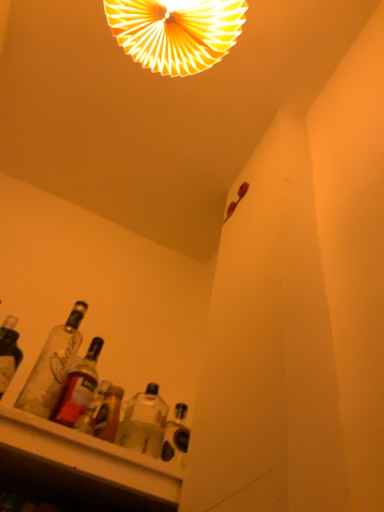
Question: From a real-world perspective, does clear glass bottles at lower left, the 1th bottle positioned from the left, sit lower than translucent glass bottle at lower left, which is counted as the 1th bottle, starting from the right?

Choices:
 (A) no
 (B) yes

Answer: (A)

Question: Does clear glass bottles at lower left, the second bottle when ordered from right to left, have a greater width compared to translucent glass bottle at lower left, which is the second bottle in left-to-right order?

Choices:
 (A) yes
 (B) no

Answer: (A)

Question: From the image's perspective, would you say clear glass bottles at lower left, the second bottle when ordered from right to left, is positioned over translucent glass bottle at lower left, which is the second bottle in left-to-right order?

Choices:
 (A) yes
 (B) no

Answer: (A)

Question: Does clear glass bottles at lower left, the 1th bottle positioned from the left, have a larger size compared to translucent glass bottle at lower left, which is counted as the 1th bottle, starting from the right?

Choices:
 (A) yes
 (B) no

Answer: (A)

Question: Is clear glass bottles at lower left, the 1th bottle positioned from the left, to the right of translucent glass bottle at lower left, which is counted as the 1th bottle, starting from the right, from the viewer's perspective?

Choices:
 (A) yes
 (B) no

Answer: (B)

Question: From the image's perspective, is clear glass bottles at lower left, the second bottle when ordered from right to left, located above or below white paper fan at upper center?

Choices:
 (A) below
 (B) above

Answer: (A)

Question: Is clear glass bottles at lower left, the 1th bottle positioned from the left, taller or shorter than white paper fan at upper center?

Choices:
 (A) short
 (B) tall

Answer: (A)

Question: Is clear glass bottles at lower left, the second bottle when ordered from right to left, in front of or behind white paper fan at upper center in the image?

Choices:
 (A) behind
 (B) front

Answer: (B)

Question: In terms of width, does clear glass bottles at lower left, the second bottle when ordered from right to left, look wider or thinner when compared to white paper fan at upper center?

Choices:
 (A) wide
 (B) thin

Answer: (B)

Question: Is point (89, 350) closer or farther from the camera than point (177, 36)?

Choices:
 (A) closer
 (B) farther

Answer: (B)

Question: Is translucent glass bottle at lower left, which is the second bottle in left-to-right order, wider or thinner than white paper fan at upper center?

Choices:
 (A) thin
 (B) wide

Answer: (A)

Question: From the image's perspective, is translucent glass bottle at lower left, which is the second bottle in left-to-right order, positioned above or below white paper fan at upper center?

Choices:
 (A) above
 (B) below

Answer: (B)

Question: Relative to white paper fan at upper center, is translucent glass bottle at lower left, which is the second bottle in left-to-right order, in front or behind?

Choices:
 (A) front
 (B) behind

Answer: (A)

Question: Looking at the image, does clear glass bottles at lower left, the second bottle when ordered from right to left, seem bigger or smaller compared to translucent glass bottle at lower left, which is the second bottle in left-to-right order?

Choices:
 (A) small
 (B) big

Answer: (B)

Question: From the image's perspective, is clear glass bottles at lower left, the second bottle when ordered from right to left, positioned above or below translucent glass bottle at lower left, which is counted as the 1th bottle, starting from the right?

Choices:
 (A) below
 (B) above

Answer: (B)